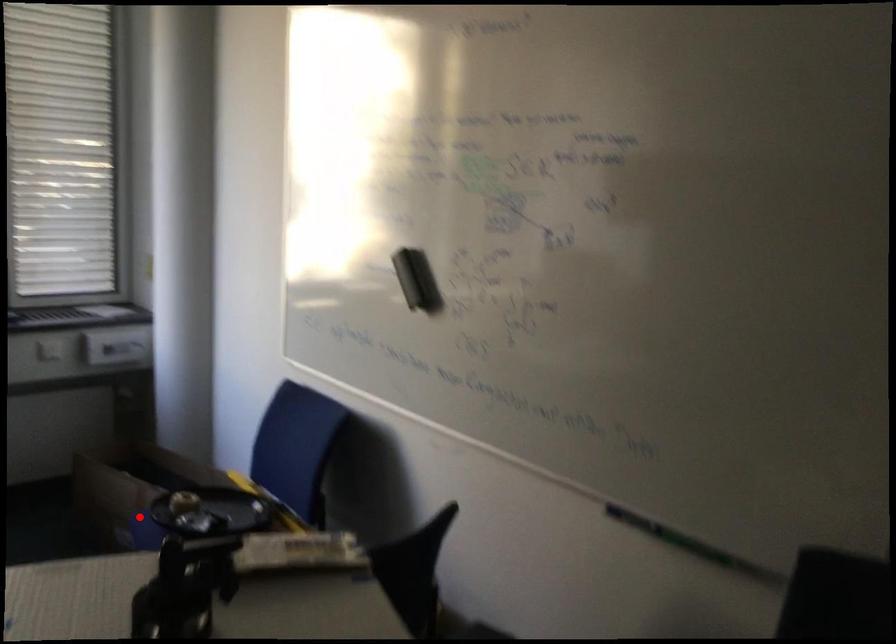
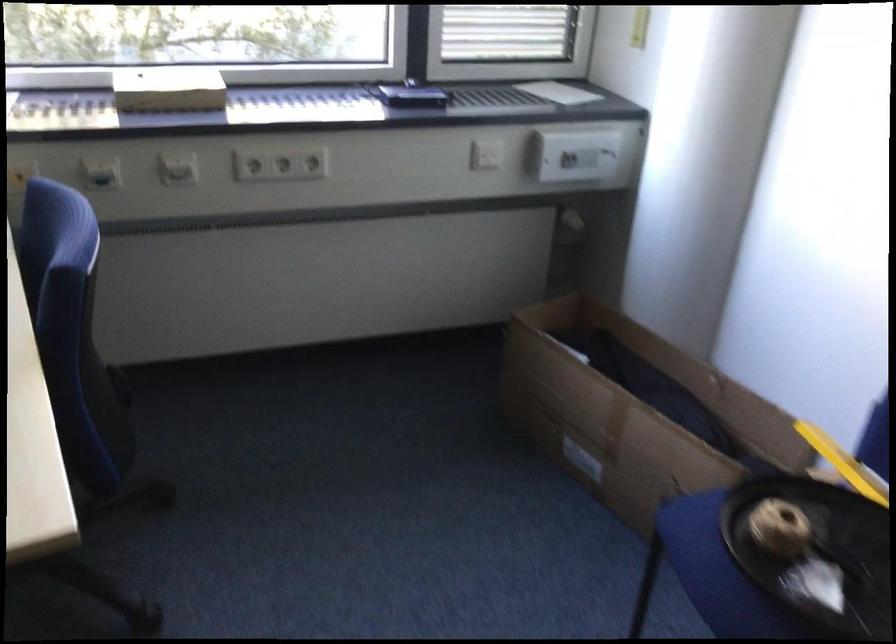
In the second image, find the point that corresponds to the highlighted location in the first image.

(695, 527)